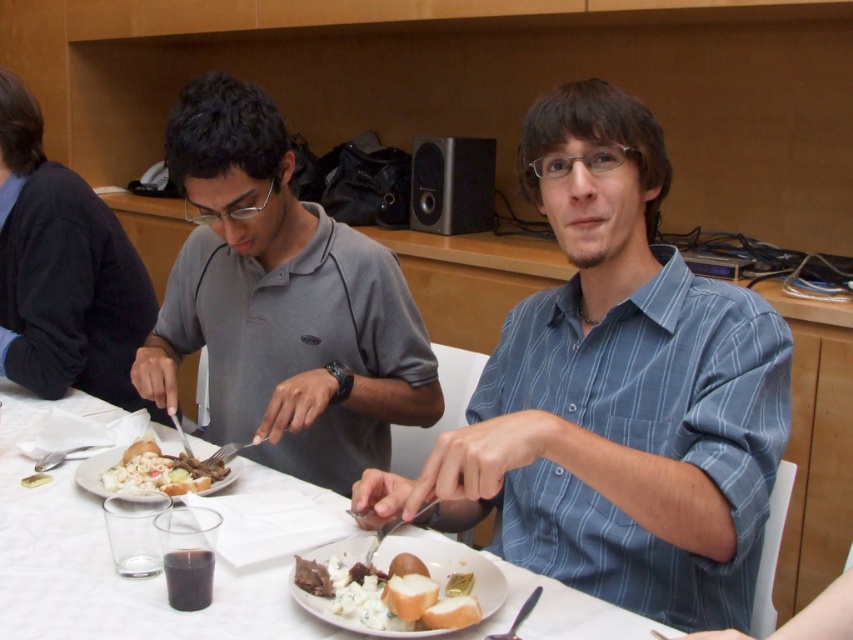
Question: Where is blue striped shirt at center located in relation to white paper plate at center in the image?

Choices:
 (A) below
 (B) above

Answer: (B)

Question: Can you confirm if blue striped shirt at center is positioned to the left of white paper plate at center?

Choices:
 (A) no
 (B) yes

Answer: (A)

Question: Which point is closer to the camera taking this photo?

Choices:
 (A) (306, 600)
 (B) (366, 308)
 (C) (625, 605)
 (D) (149, 481)

Answer: (A)

Question: Which object is the closest to the blue striped shirt at center?

Choices:
 (A) white bread at lower center
 (B) gray matte shirt at left
 (C) white paper plate at center

Answer: (A)

Question: Is blue striped shirt at center further to camera compared to black sweater at left?

Choices:
 (A) no
 (B) yes

Answer: (A)

Question: Considering the real-world distances, which object is farthest from the white bread at lower center?

Choices:
 (A) black sweater at left
 (B) white paper plate at center
 (C) blue striped shirt at center

Answer: (A)